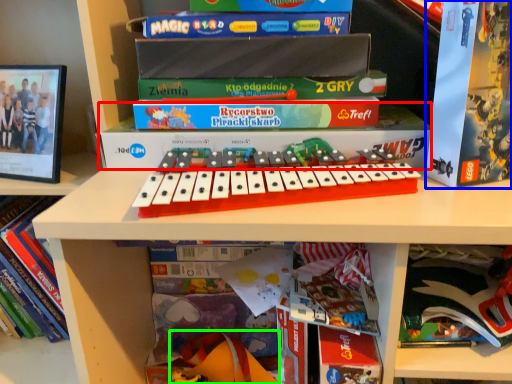
Question: Which is nearer to the paperback book (highlighted by a red box)? paperback book (highlighted by a blue box) or toy (highlighted by a green box).

Choices:
 (A) paperback book
 (B) toy

Answer: (A)